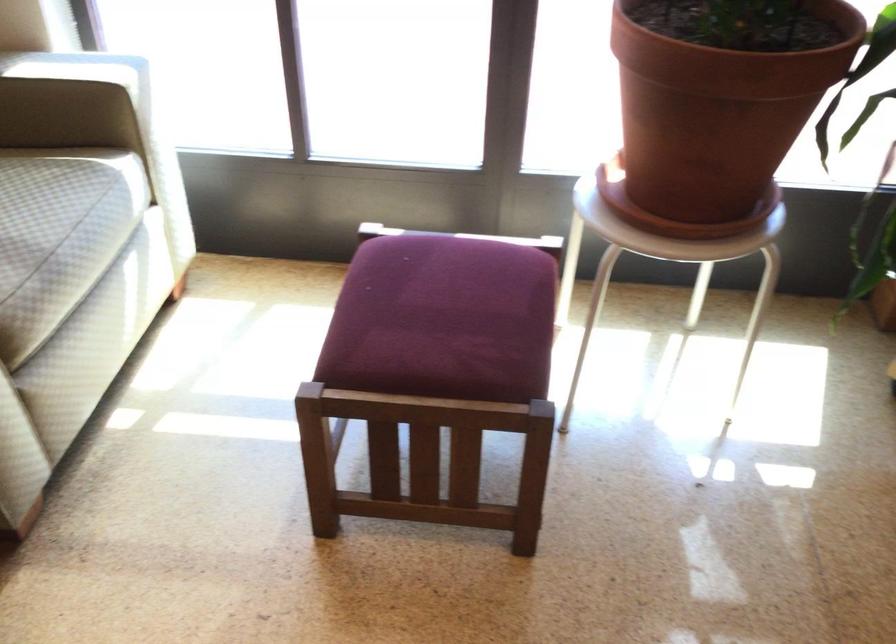
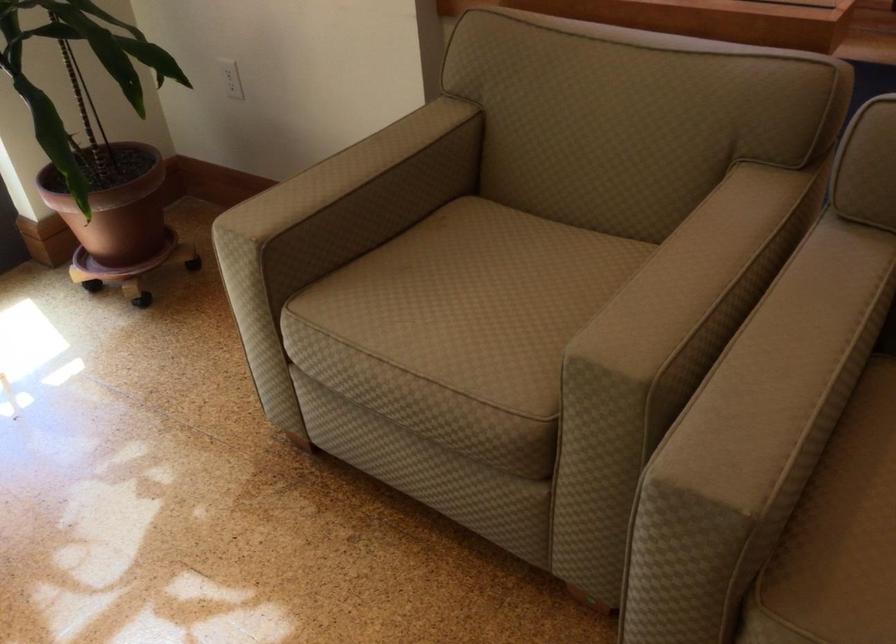
Question: The first image is from the beginning of the video and the second image is from the end. How did the camera likely rotate when shooting the video?

Choices:
 (A) Left
 (B) Right
 (C) Up
 (D) Down

Answer: (B)